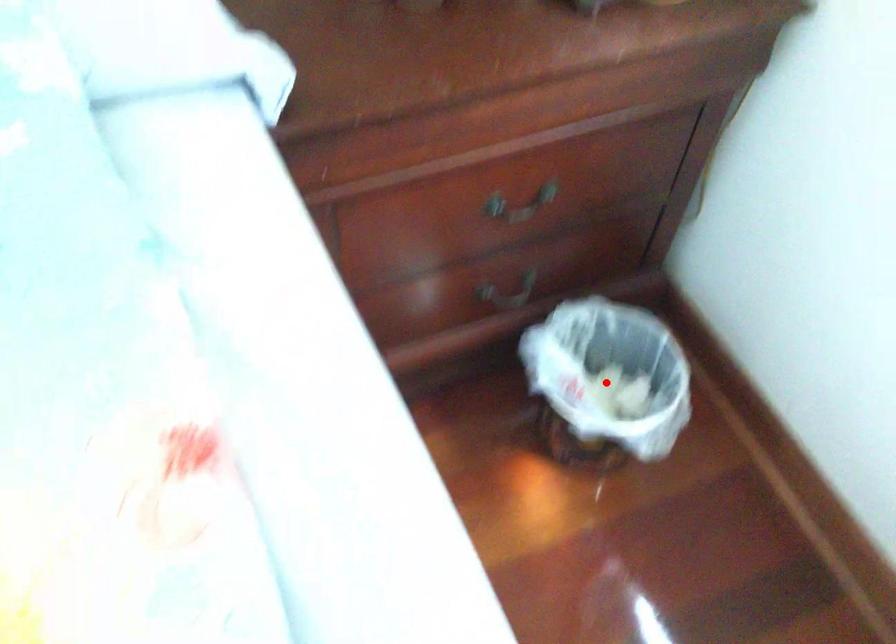
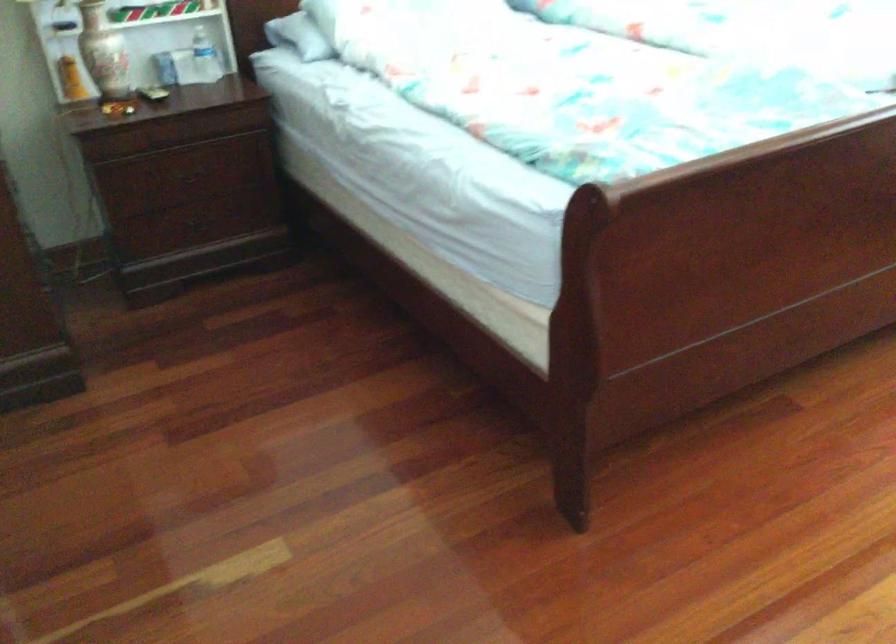
Question: I am providing you with two images of the same scene from different viewpoints. A red point is marked on the first image. Is the red point's position out of view in image 2?

Choices:
 (A) Yes
 (B) No

Answer: (A)